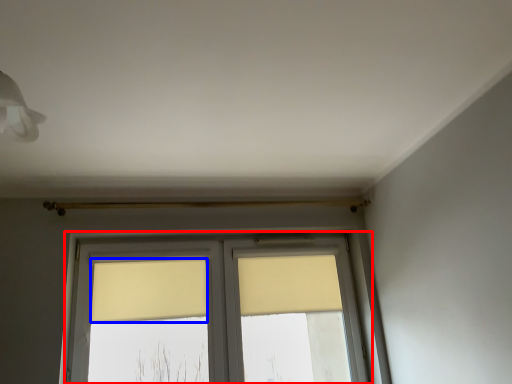
Question: Among these objects, which one is nearest to the camera, window (highlighted by a red box) or curtain (highlighted by a blue box)?

Choices:
 (A) window
 (B) curtain

Answer: (A)